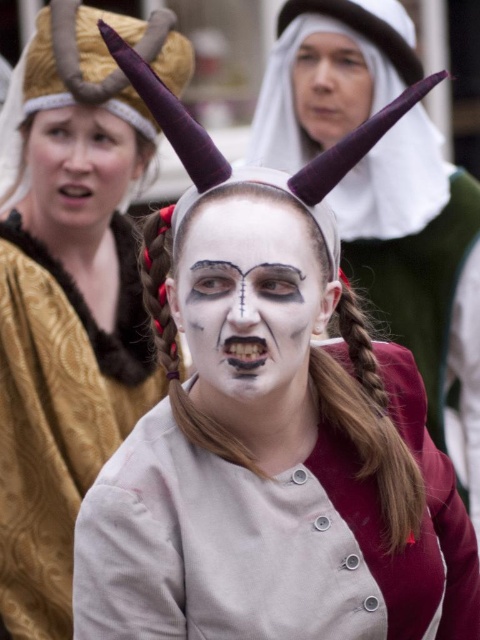
You are taking a photo of the scene and want to focus on the two points in the image. Which point, point [113,305] or point [269,310], is closer to the camera?

Point [113,305] is closer to the camera than point [269,310] because it is further to the camera than the other point.

Based on the scene description, which object is wider, the white matte face paint at center or the matte gold headband at upper left?

The white matte face paint at center is wider than the matte gold headband at upper left according to the description.